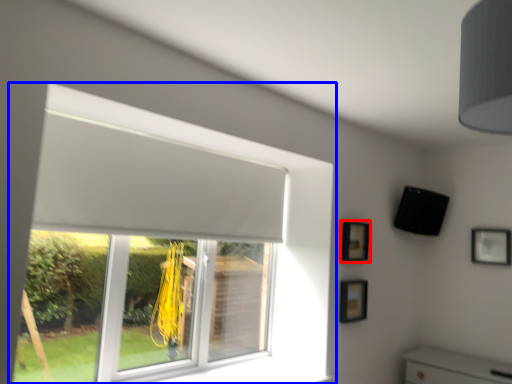
Question: Which object appears closest to the camera in this image, picture frame (highlighted by a red box) or window (highlighted by a blue box)?

Choices:
 (A) picture frame
 (B) window

Answer: (B)